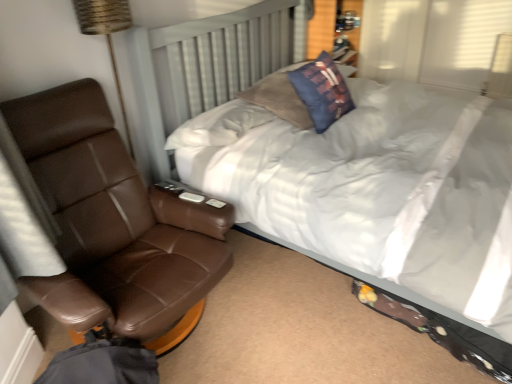
Question: Can you confirm if blue fabric pillow at upper center is wider than white soft bed at center?

Choices:
 (A) yes
 (B) no

Answer: (B)

Question: Is blue fabric pillow at upper center in front of white soft bed at center?

Choices:
 (A) yes
 (B) no

Answer: (B)

Question: Does blue fabric pillow at upper center appear on the left side of white soft bed at center?

Choices:
 (A) yes
 (B) no

Answer: (A)

Question: Considering the relative sizes of blue fabric pillow at upper center and white soft bed at center in the image provided, is blue fabric pillow at upper center taller than white soft bed at center?

Choices:
 (A) yes
 (B) no

Answer: (B)

Question: Does blue fabric pillow at upper center appear on the right side of white soft bed at center?

Choices:
 (A) no
 (B) yes

Answer: (A)

Question: Is blue fabric pillow at upper center to the left or to the right of brown leather chair at left in the image?

Choices:
 (A) left
 (B) right

Answer: (B)

Question: From a real-world perspective, relative to brown leather chair at left, is blue fabric pillow at upper center vertically above or below?

Choices:
 (A) above
 (B) below

Answer: (A)

Question: In terms of height, does blue fabric pillow at upper center look taller or shorter compared to brown leather chair at left?

Choices:
 (A) short
 (B) tall

Answer: (A)

Question: Which is correct: blue fabric pillow at upper center is inside brown leather chair at left, or outside of it?

Choices:
 (A) inside
 (B) outside

Answer: (B)

Question: Visually, is brown leather chair at left positioned to the left or to the right of blue fabric pillow at upper center?

Choices:
 (A) left
 (B) right

Answer: (A)

Question: In terms of size, does brown leather chair at left appear bigger or smaller than blue fabric pillow at upper center?

Choices:
 (A) small
 (B) big

Answer: (B)

Question: From the image's perspective, is brown leather chair at left positioned above or below blue fabric pillow at upper center?

Choices:
 (A) below
 (B) above

Answer: (A)

Question: From a real-world perspective, relative to blue fabric pillow at upper center, is brown leather chair at left vertically above or below?

Choices:
 (A) above
 (B) below

Answer: (B)

Question: From the image's perspective, relative to blue fabric pillow at upper center, is white soft bed at center above or below?

Choices:
 (A) above
 (B) below

Answer: (B)

Question: Is white soft bed at center inside the boundaries of blue fabric pillow at upper center, or outside?

Choices:
 (A) inside
 (B) outside

Answer: (B)